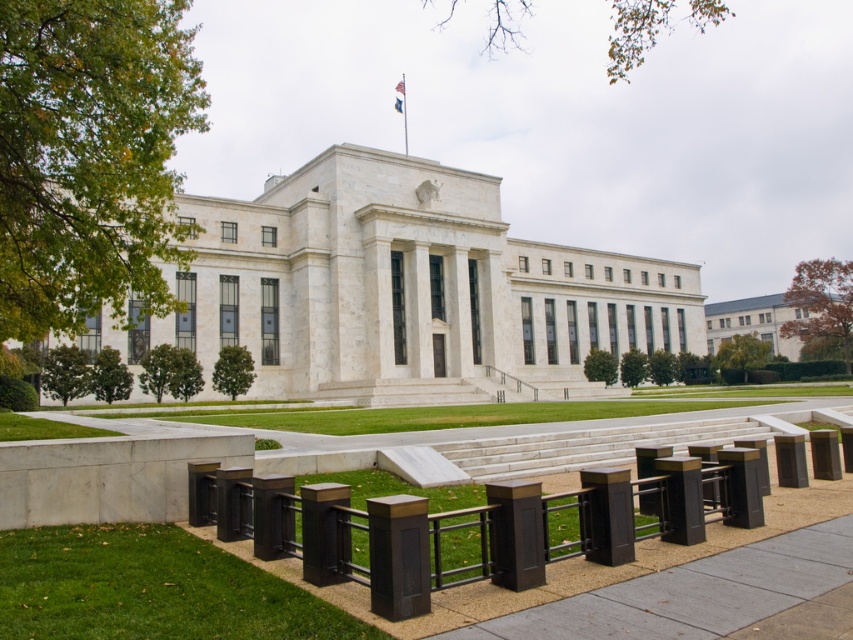
Question: Estimate the real-world distances between objects in this image. Which object is closer to the green grass at lower left?

Choices:
 (A) matte brown post at center
 (B) matte black post at center

Answer: (A)

Question: Considering the relative positions of green grass at lower left and matte brown post at center in the image provided, where is green grass at lower left located with respect to matte brown post at center?

Choices:
 (A) above
 (B) below

Answer: (B)

Question: Which object is closer to the camera taking this photo?

Choices:
 (A) green grass at lower left
 (B) matte black post at center
 (C) matte brown post at center

Answer: (A)

Question: Estimate the real-world distances between objects in this image. Which object is farther from the matte brown post at center?

Choices:
 (A) matte black post at center
 (B) green grass at lower left

Answer: (B)

Question: Is green grass at lower left to the right of matte brown post at center from the viewer's perspective?

Choices:
 (A) no
 (B) yes

Answer: (A)

Question: Does matte brown post at center appear on the left side of matte black post at center?

Choices:
 (A) yes
 (B) no

Answer: (A)